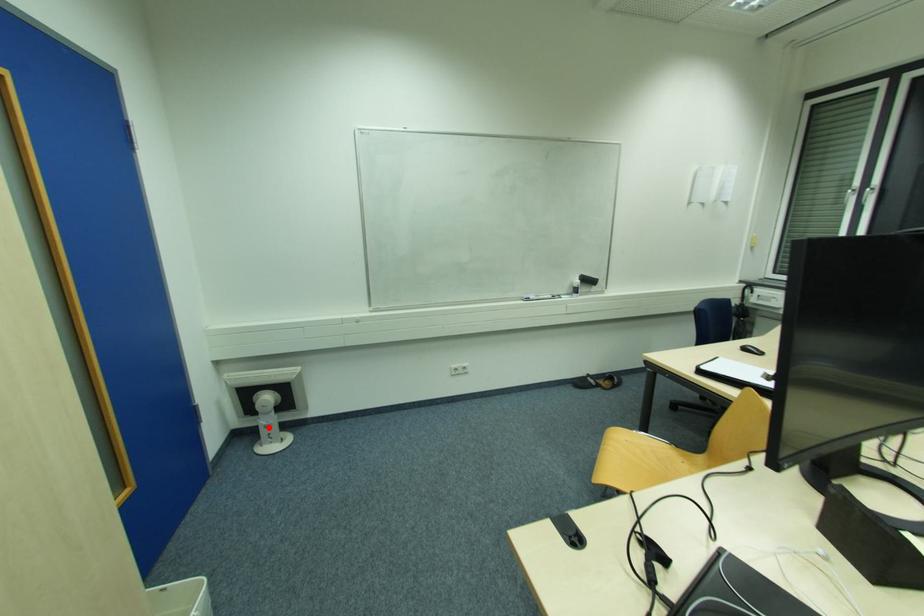
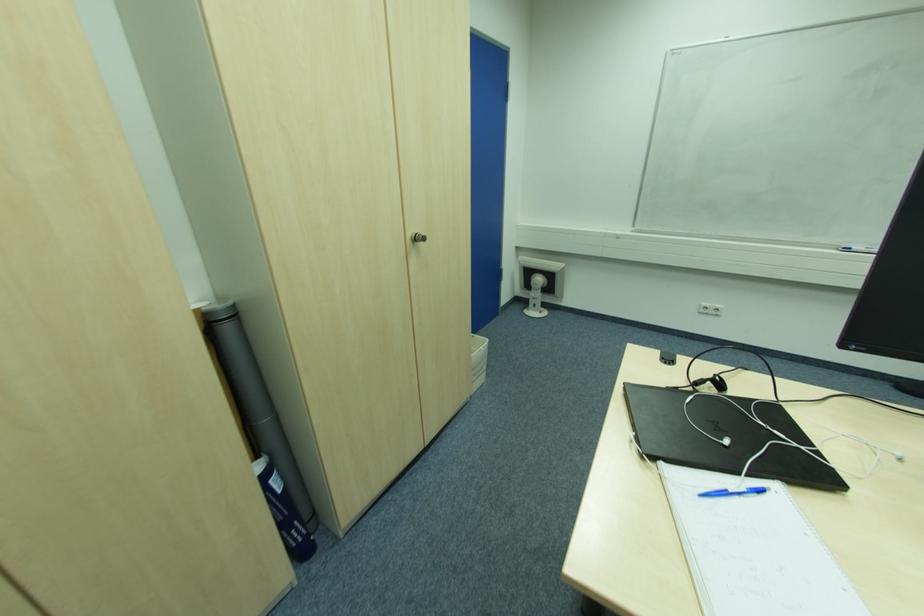
Question: A red point is marked in image1. In image2, is the corresponding 3D point closer to the camera or farther? Reply with the corresponding letter.

Choices:
 (A) The corresponding 3D point is closer.
 (B) The corresponding 3D point is farther.

Answer: (A)